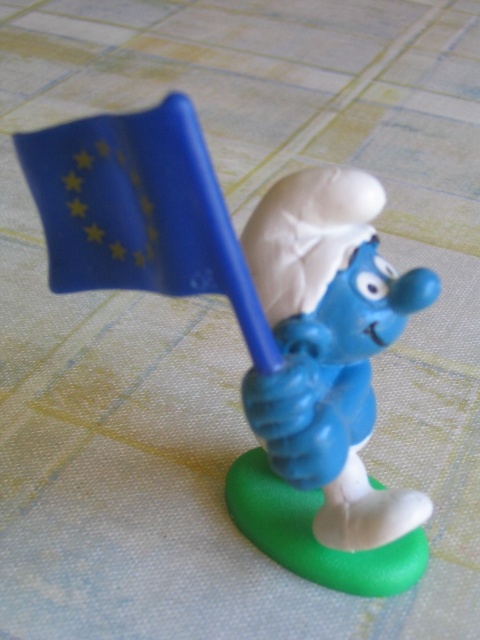
Is blue plastic smurf at center to the left of blue matte flag at upper center from the viewer's perspective?

In fact, blue plastic smurf at center is to the right of blue matte flag at upper center.

You are a GUI agent. You are given a task and a screenshot of the screen. Output one action in this format:
    pyautogui.click(x=<x>, y=<y>)
    Task: Click on the blue plastic smurf at center
    
    Given the screenshot: What is the action you would take?
    pyautogui.click(x=254, y=321)

Is blue matte smurf at center above blue matte flag at upper center?

Actually, blue matte smurf at center is below blue matte flag at upper center.

Can you confirm if blue matte smurf at center is bigger than blue matte flag at upper center?

Yes, blue matte smurf at center is bigger than blue matte flag at upper center.

Between point (256, 252) and point (40, 186), which one is positioned in front?

Point (40, 186) is more forward.

The image size is (480, 640). I want to click on blue matte smurf at center, so click(x=325, y=387).

Who is shorter, blue plastic smurf at center or blue matte smurf at center?

blue matte smurf at center

Between point (312, 563) and point (416, 280), which one is positioned behind?

Point (312, 563)

Locate an element on the screen. blue plastic smurf at center is located at coordinates (254, 321).